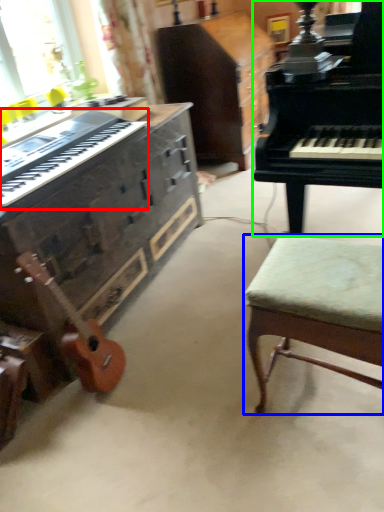
Question: Which is farther away from musical keyboard (highlighted by a red box)? stool (highlighted by a blue box) or piano (highlighted by a green box)?

Choices:
 (A) stool
 (B) piano

Answer: (A)